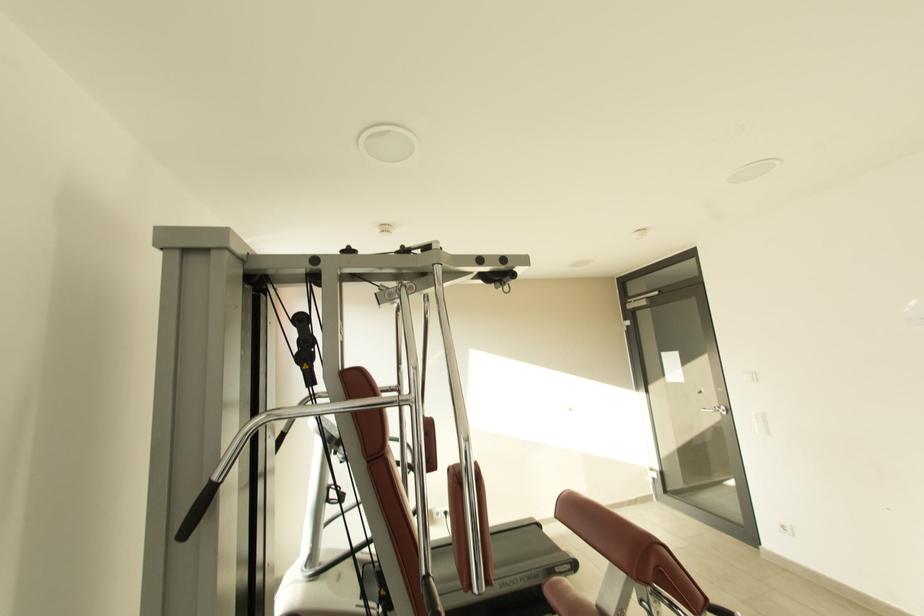
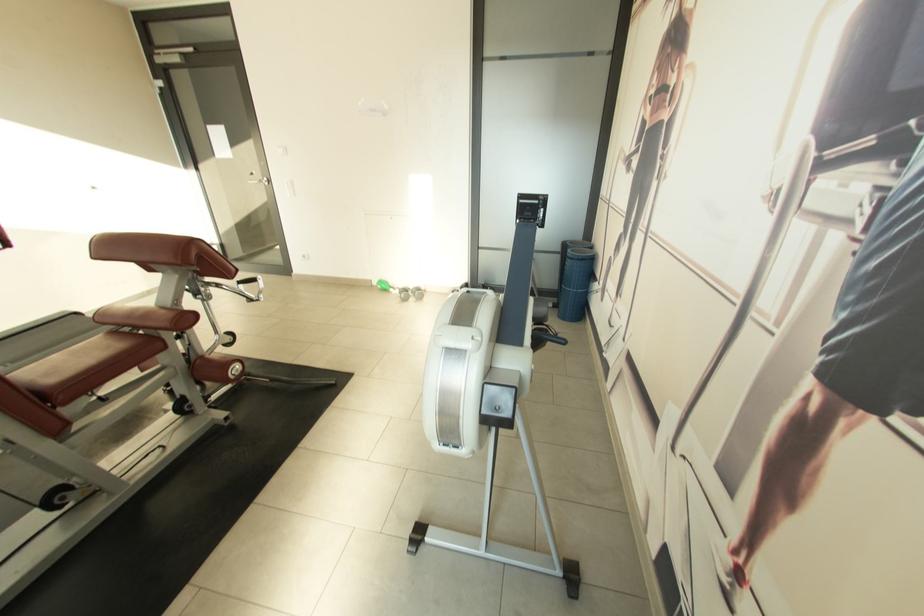
In the second image, find the point that corresponds to point 706,392 in the first image.

(258, 175)